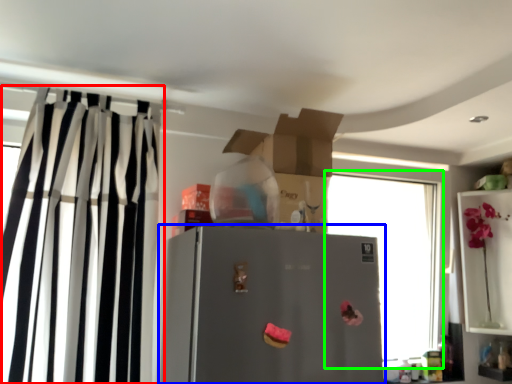
Question: Based on their relative distances, which object is farther from curtain (highlighted by a red box)? Choose from refrigerator (highlighted by a blue box) and window (highlighted by a green box).

Choices:
 (A) refrigerator
 (B) window

Answer: (B)